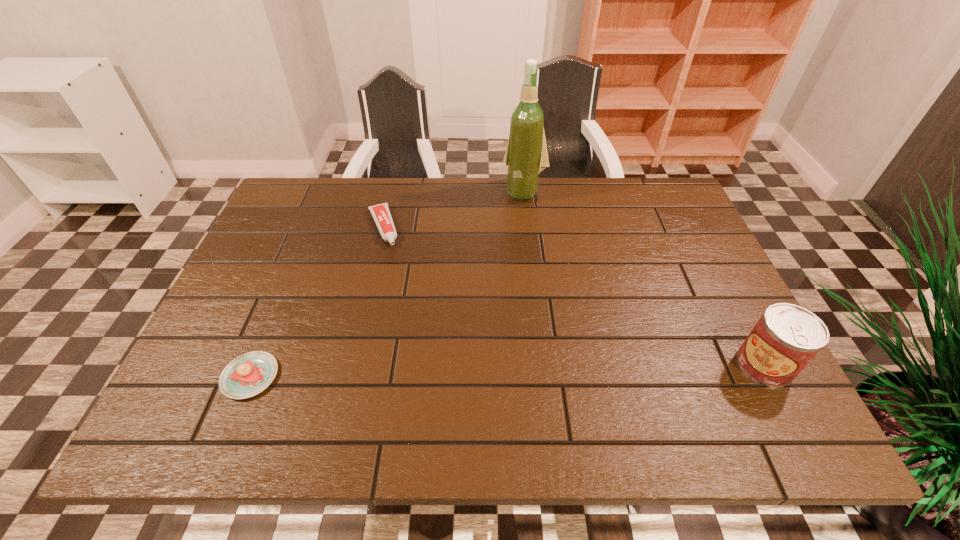
At what (x,y) coordinates should I click in order to perform the action: click on unoccupied area between the farthest object and the rightmost object. Please return your answer as a coordinate pair (x, y). Looking at the image, I should click on (644, 278).

I want to click on empty space that is in between the third object from right to left and the pastry, so click(x=317, y=302).

Find the location of a particular element. Image resolution: width=960 pixels, height=540 pixels. free space between the can and the farthest object is located at coordinates (644, 278).

Locate an element on the screen. This screenshot has height=540, width=960. unoccupied area between the wine bottle and the leftmost object is located at coordinates (387, 284).

The image size is (960, 540). Find the location of `free space that is in between the wine bottle and the third nearest object`. free space that is in between the wine bottle and the third nearest object is located at coordinates (453, 209).

The image size is (960, 540). In order to click on empty location between the pastry and the can in this screenshot , I will do `click(508, 370)`.

You are a GUI agent. You are given a task and a screenshot of the screen. Output one action in this format:
    pyautogui.click(x=<x>, y=<y>)
    Task: Click on the vacant area between the tallest object and the toothpaste
    The image size is (960, 540).
    Given the screenshot: What is the action you would take?
    pyautogui.click(x=453, y=209)

The height and width of the screenshot is (540, 960). Identify the location of free area in between the pastry and the toothpaste. (317, 302).

Find the location of a particular element. This screenshot has width=960, height=540. the closest object to the third object from left to right is located at coordinates (381, 214).

Locate which object is the third closest to the rightmost object. Please provide its 2D coordinates. Your answer should be formatted as a tuple, i.e. [(x, y)], where the tuple contains the x and y coordinates of a point satisfying the conditions above.

[(249, 374)]